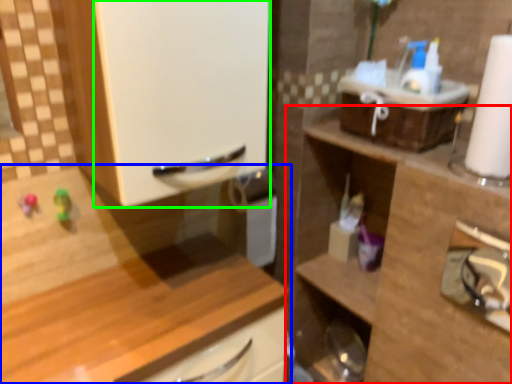
Question: Which object is positioned farthest from cabinetry (highlighted by a red box)? Select from cabinetry (highlighted by a blue box) and screen door (highlighted by a green box).

Choices:
 (A) cabinetry
 (B) screen door

Answer: (B)